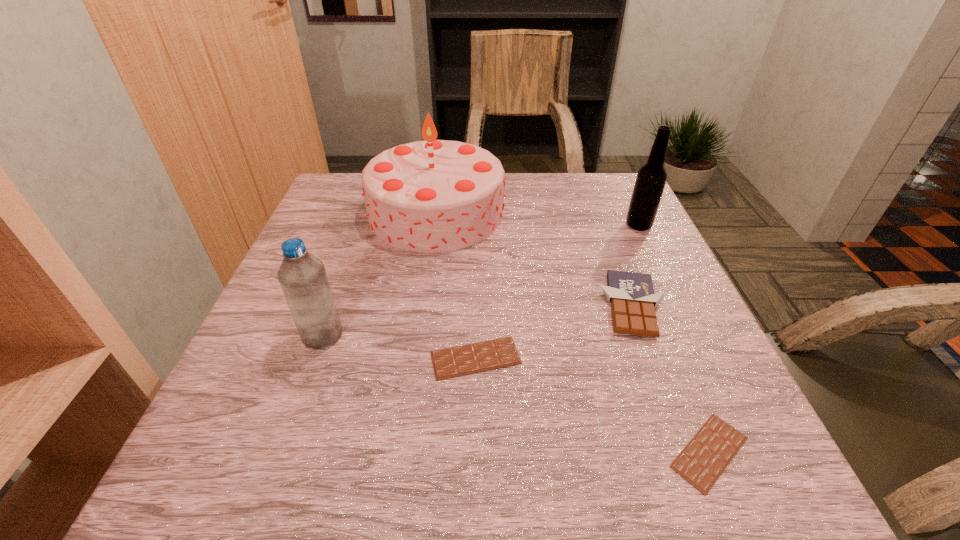
This screenshot has height=540, width=960. I want to click on free spot located 0.190m on the back of the third shortest object, so click(x=604, y=227).

The width and height of the screenshot is (960, 540). Find the location of `free space located on the right of the leftmost chocolate bar`. free space located on the right of the leftmost chocolate bar is located at coordinates (702, 358).

The height and width of the screenshot is (540, 960). Identify the location of vacant point located on the left of the shortest object. (393, 452).

At what (x,y) coordinates should I click in order to perform the action: click on birthday cake located in the far edge section of the desktop. Please return your answer as a coordinate pair (x, y). Looking at the image, I should click on (430, 196).

You are a GUI agent. You are given a task and a screenshot of the screen. Output one action in this format:
    pyautogui.click(x=<x>, y=<y>)
    Task: Click on the beer bottle located at the far edge
    This screenshot has width=960, height=540.
    Given the screenshot: What is the action you would take?
    pyautogui.click(x=651, y=178)

Where is `object positioned at the near edge`? The image size is (960, 540). object positioned at the near edge is located at coordinates (703, 460).

The width and height of the screenshot is (960, 540). Identify the location of birthday cake that is positioned at the left edge. (430, 196).

Where is `water bottle that is at the left edge`? This screenshot has width=960, height=540. water bottle that is at the left edge is located at coordinates (302, 276).

This screenshot has height=540, width=960. What are the coordinates of `beer bottle that is positioned at the right edge` in the screenshot? It's located at (651, 178).

The width and height of the screenshot is (960, 540). What are the coordinates of `object located in the far left corner section of the desktop` in the screenshot? It's located at (430, 196).